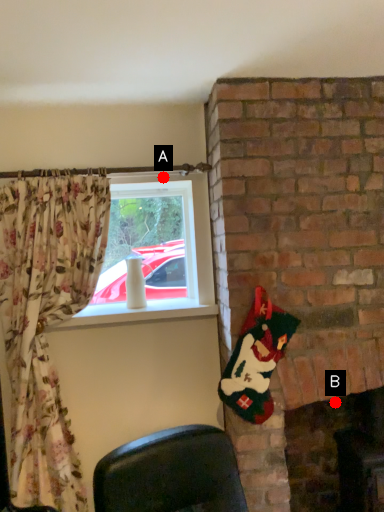
Question: Two points are circled on the image, labeled by A and B beside each circle. Which point appears farthest from the camera in this image?

Choices:
 (A) A is further
 (B) B is further

Answer: (B)